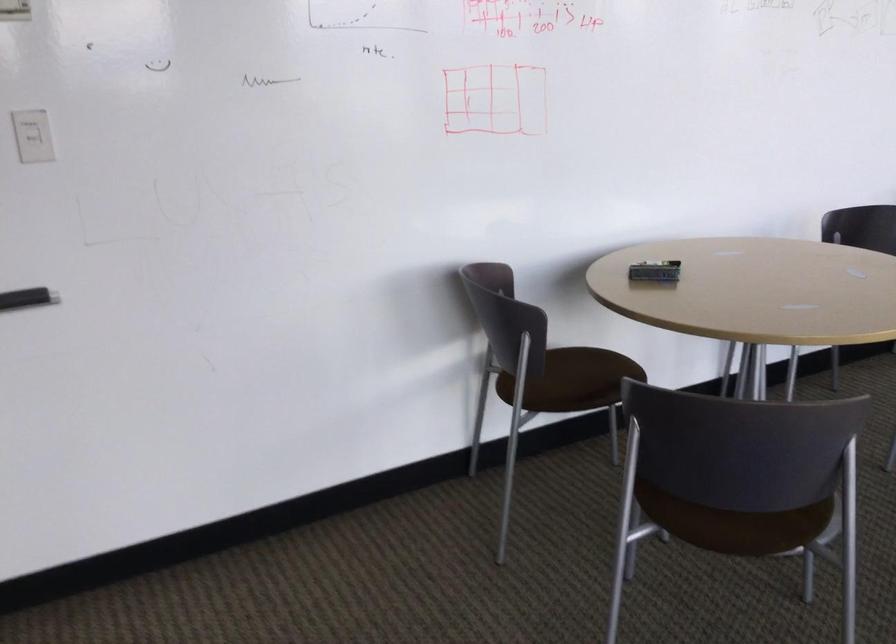
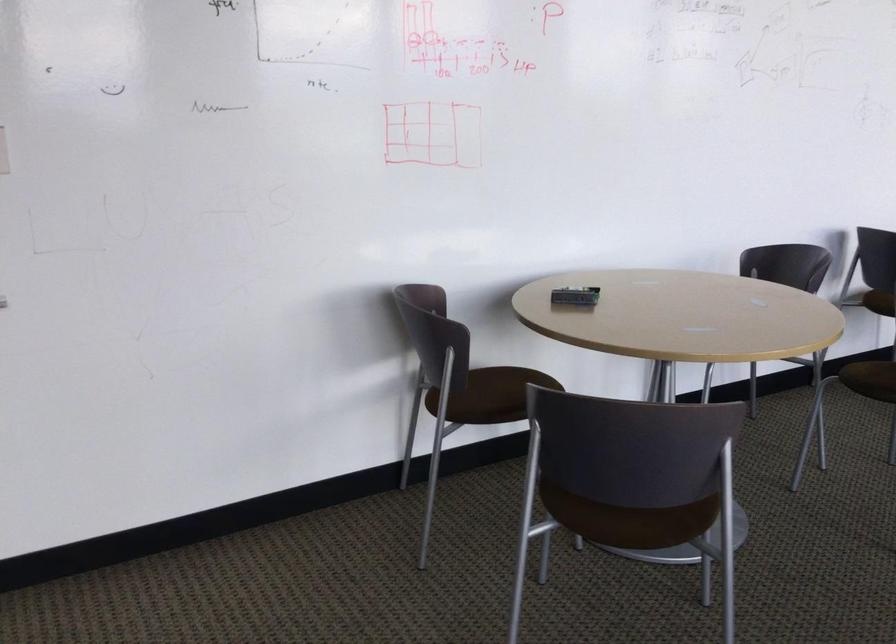
Find the pixel in the second image that matches point (535, 357) in the first image.

(458, 371)